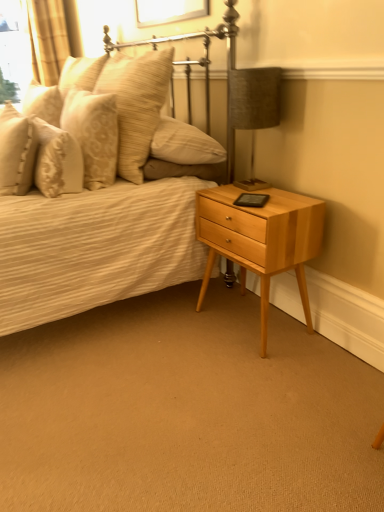
Question: Considering the relative sizes of matte beige pillow at upper left, which appears as the fourth pillow when viewed from the right, and patterned fabric pillow at upper left, the third pillow positioned from the left, in the image provided, is matte beige pillow at upper left, which appears as the fourth pillow when viewed from the right, bigger than patterned fabric pillow at upper left, the third pillow positioned from the left,?

Choices:
 (A) no
 (B) yes

Answer: (A)

Question: Is matte beige pillow at upper left, which appears as the fourth pillow when viewed from the right, wider than patterned fabric pillow at upper left, placed as the second pillow when sorted from right to left?

Choices:
 (A) yes
 (B) no

Answer: (A)

Question: Could you tell me if matte beige pillow at upper left, the first pillow viewed from the left, is facing patterned fabric pillow at upper left, the third pillow positioned from the left?

Choices:
 (A) yes
 (B) no

Answer: (B)

Question: Is matte beige pillow at upper left, the first pillow viewed from the left, further to the viewer compared to patterned fabric pillow at upper left, the third pillow positioned from the left?

Choices:
 (A) yes
 (B) no

Answer: (A)

Question: From the image's perspective, is matte beige pillow at upper left, which appears as the fourth pillow when viewed from the right, located above patterned fabric pillow at upper left, placed as the second pillow when sorted from right to left?

Choices:
 (A) yes
 (B) no

Answer: (A)

Question: Is matte beige pillow at upper left, which appears as the fourth pillow when viewed from the right, not within patterned fabric pillow at upper left, placed as the second pillow when sorted from right to left?

Choices:
 (A) yes
 (B) no

Answer: (A)

Question: Can you confirm if textured fabric lampshade at upper right is taller than patterned fabric pillow at upper left, placed as the second pillow when sorted from right to left?

Choices:
 (A) yes
 (B) no

Answer: (A)

Question: Can you confirm if textured fabric lampshade at upper right is wider than patterned fabric pillow at upper left, the third pillow positioned from the left?

Choices:
 (A) yes
 (B) no

Answer: (A)

Question: Does textured fabric lampshade at upper right have a lesser height compared to patterned fabric pillow at upper left, placed as the second pillow when sorted from right to left?

Choices:
 (A) no
 (B) yes

Answer: (A)

Question: Is textured fabric lampshade at upper right outside patterned fabric pillow at upper left, placed as the second pillow when sorted from right to left?

Choices:
 (A) yes
 (B) no

Answer: (A)

Question: From the image's perspective, is textured fabric lampshade at upper right located beneath patterned fabric pillow at upper left, the third pillow positioned from the left?

Choices:
 (A) no
 (B) yes

Answer: (B)

Question: Does textured fabric lampshade at upper right have a larger size compared to patterned fabric pillow at upper left, placed as the second pillow when sorted from right to left?

Choices:
 (A) yes
 (B) no

Answer: (B)

Question: From a real-world perspective, does light wood/finely finished nightstand at lower right stand above soft beige pillow at upper left, which is the first pillow from right to left?

Choices:
 (A) yes
 (B) no

Answer: (B)